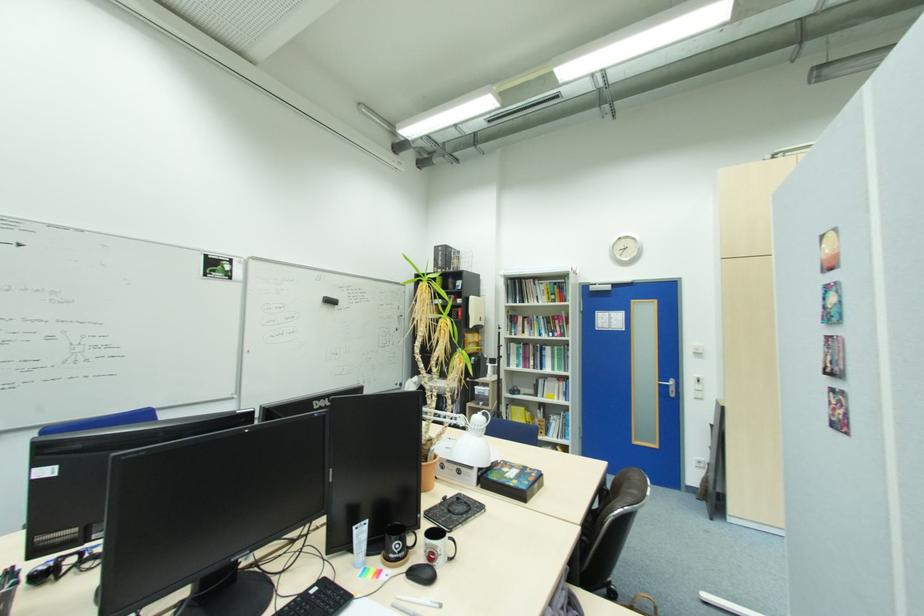
Where would you lift the black coffee mug? Please return your answer as a coordinate pair (x, y).

(395, 544)